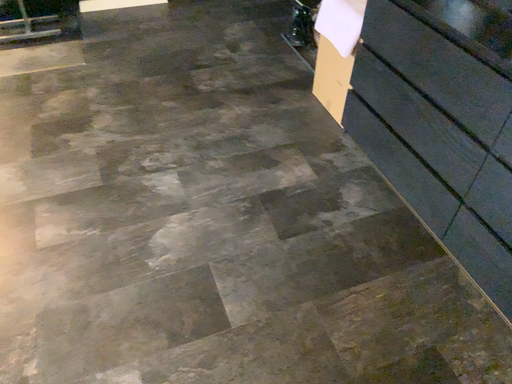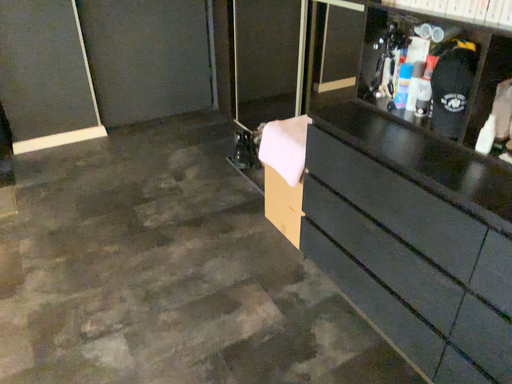
Question: Which way did the camera rotate in the video?

Choices:
 (A) rotated upward
 (B) rotated downward

Answer: (A)